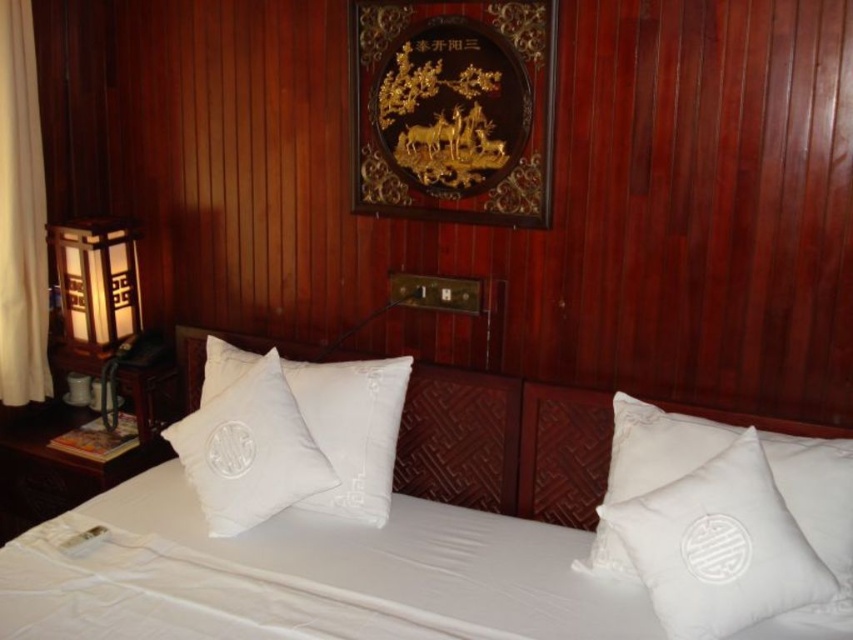
Question: Which of the following is the farthest from the observer?

Choices:
 (A) (601, 556)
 (B) (402, 515)
 (C) (28, 220)

Answer: (C)

Question: In this image, where is white soft pillows at center located relative to white fabric curtain at left?

Choices:
 (A) below
 (B) above

Answer: (A)

Question: Is white soft pillows at center further to camera compared to white fabric curtain at left?

Choices:
 (A) no
 (B) yes

Answer: (A)

Question: Based on their relative distances, which object is farther from the white soft pillows at center?

Choices:
 (A) matte wooden lamp at left
 (B) white fabric curtain at left
 (C) white quilted pillow at center

Answer: (B)

Question: Is white soft pillows at center thinner than white fabric curtain at left?

Choices:
 (A) no
 (B) yes

Answer: (A)

Question: Which point appears farthest from the camera in this image?

Choices:
 (A) (724, 426)
 (B) (113, 300)

Answer: (B)